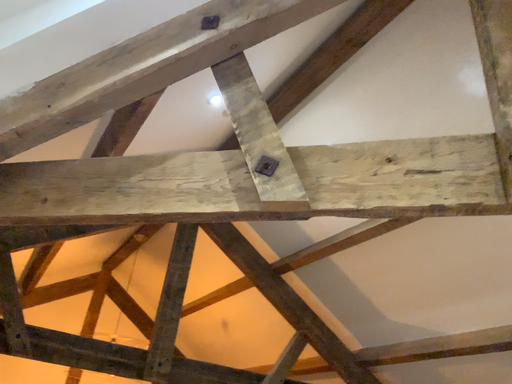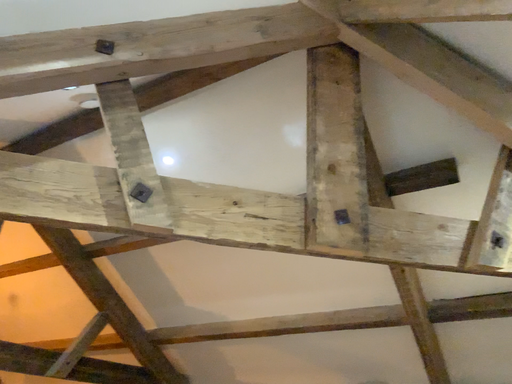
Question: How did the camera likely rotate when shooting the video?

Choices:
 (A) rotated left
 (B) rotated right

Answer: (B)